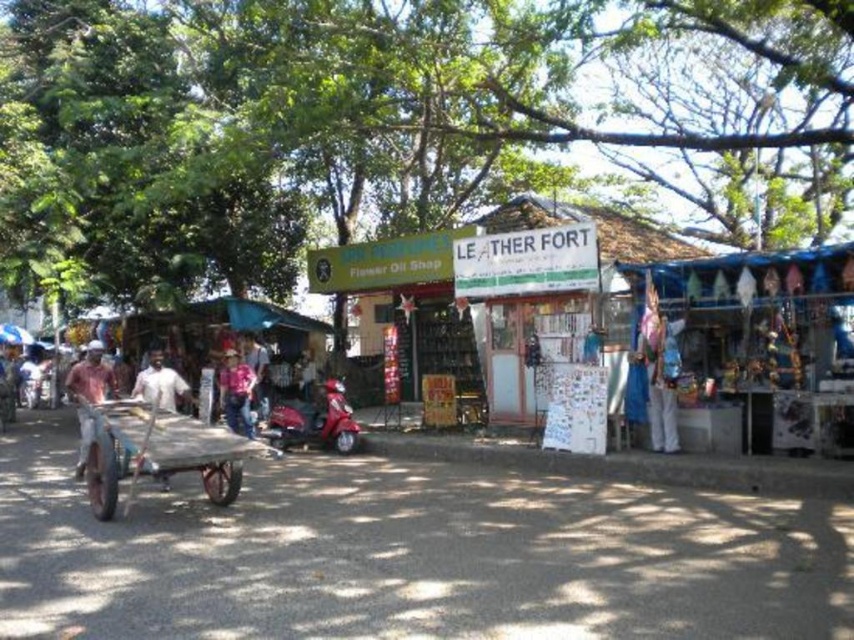
Question: Can you confirm if wooden cart at center is wider than light brown wooden cart at left?

Choices:
 (A) no
 (B) yes

Answer: (A)

Question: Is reddish-brown fabric shirt at left to the left of white matte shirt at center from the viewer's perspective?

Choices:
 (A) no
 (B) yes

Answer: (B)

Question: Among these points, which one is farthest from the camera?

Choices:
 (A) (98, 342)
 (B) (227, 380)
 (C) (120, 436)

Answer: (B)

Question: Which point appears closest to the camera in this image?

Choices:
 (A) (80, 387)
 (B) (161, 474)

Answer: (B)

Question: Does pink cotton shirt at center lie behind white matte shirt at center?

Choices:
 (A) yes
 (B) no

Answer: (A)

Question: Which is farther from the pink cotton shirt at center?

Choices:
 (A) shiny red motorcycle at center
 (B) reddish-brown fabric shirt at left

Answer: (B)